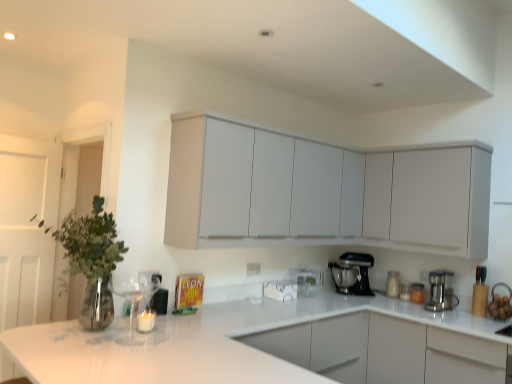
Question: Can you confirm if white matte cabinet at upper right, the 1th cabinetry in the right-to-left sequence, is bigger than satin silver coffee maker at right, placed as the first kitchen appliance when sorted from right to left?

Choices:
 (A) yes
 (B) no

Answer: (A)

Question: Is white matte cabinet at upper right, the 1th cabinetry in the right-to-left sequence, at the right side of satin silver coffee maker at right, which appears as the 2th kitchen appliance when viewed from the left?

Choices:
 (A) no
 (B) yes

Answer: (A)

Question: Is satin silver coffee maker at right, which appears as the 2th kitchen appliance when viewed from the left, a part of white matte cabinet at upper right, acting as the second cabinetry starting from the left?

Choices:
 (A) no
 (B) yes

Answer: (A)

Question: From a real-world perspective, is white matte cabinet at upper right, the 1th cabinetry in the right-to-left sequence, over satin silver coffee maker at right, which appears as the 2th kitchen appliance when viewed from the left?

Choices:
 (A) no
 (B) yes

Answer: (B)

Question: From the image's perspective, is white matte cabinet at upper right, the 1th cabinetry in the right-to-left sequence, located beneath satin silver coffee maker at right, the first kitchen appliance positioned from the front?

Choices:
 (A) no
 (B) yes

Answer: (A)

Question: Is white matte cabinet at upper right, acting as the second cabinetry starting from the left, to the left of satin silver coffee maker at right, placed as the first kitchen appliance when sorted from right to left, from the viewer's perspective?

Choices:
 (A) yes
 (B) no

Answer: (A)

Question: Is white glossy jar at lower right outside black metallic stand mixer at lower center, which ranks as the first kitchen appliance in left-to-right order?

Choices:
 (A) no
 (B) yes

Answer: (B)

Question: From a real-world perspective, is white glossy jar at lower right below black metallic stand mixer at lower center, which ranks as the first kitchen appliance in left-to-right order?

Choices:
 (A) no
 (B) yes

Answer: (B)

Question: Is white glossy jar at lower right with black metallic stand mixer at lower center, which is counted as the 1th kitchen appliance, starting from the back?

Choices:
 (A) no
 (B) yes

Answer: (A)

Question: Does white glossy jar at lower right have a smaller size compared to black metallic stand mixer at lower center, which is counted as the 1th kitchen appliance, starting from the back?

Choices:
 (A) yes
 (B) no

Answer: (A)

Question: Is white glossy jar at lower right not near black metallic stand mixer at lower center, the second kitchen appliance from the front?

Choices:
 (A) no
 (B) yes

Answer: (A)

Question: Is white glossy jar at lower right at the right side of black metallic stand mixer at lower center, which appears as the 2th kitchen appliance when viewed from the right?

Choices:
 (A) yes
 (B) no

Answer: (A)

Question: Does satin silver coffee maker at right, the first kitchen appliance positioned from the front, have a greater height compared to white glossy sink at lower right?

Choices:
 (A) no
 (B) yes

Answer: (B)